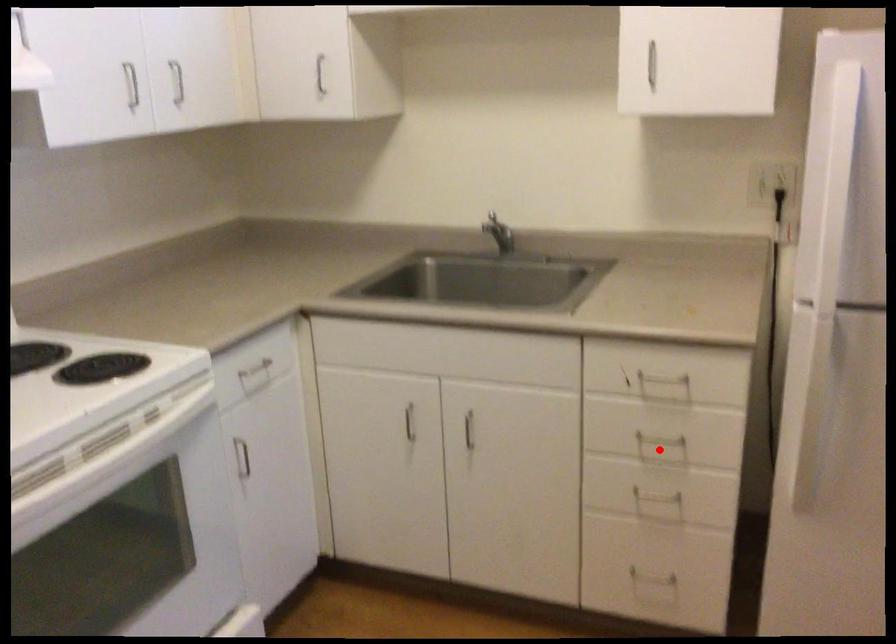
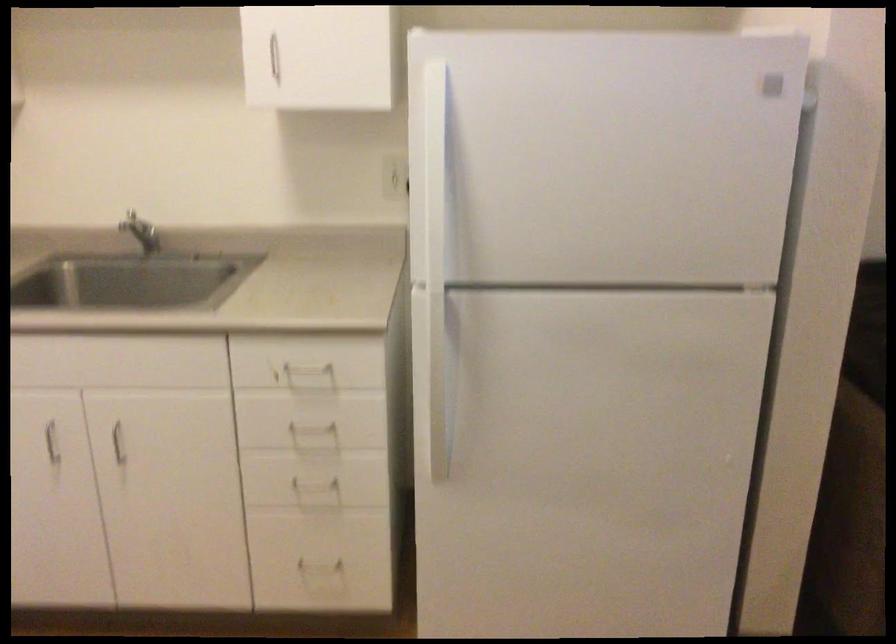
Find the pixel in the second image that matches the highlighted location in the first image.

(314, 436)